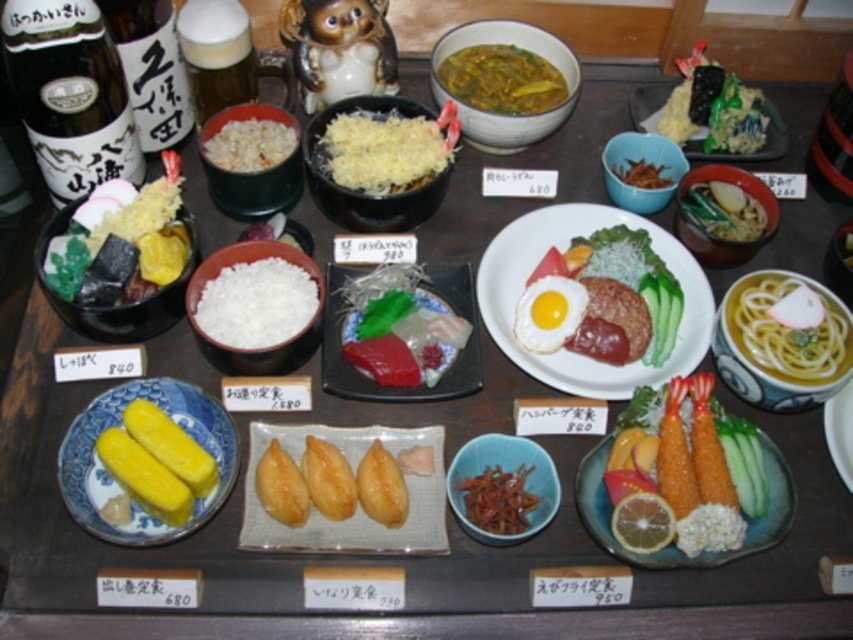
You are a guest at a Japanese dinner and see the matte black bowl at left and the yellow soft tofu at center on the table. Which dish is closer to you?

The yellow soft tofu at center is closer to you because the matte black bowl at left is above it, meaning it is positioned higher and farther away.